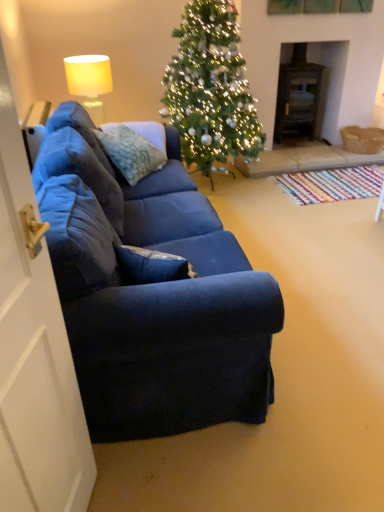
Question: From the image's perspective, does green matte christmas tree at center appear lower than matte yellow fabric lampshade at upper left?

Choices:
 (A) yes
 (B) no

Answer: (B)

Question: Considering the relative sizes of green matte christmas tree at center and matte yellow fabric lampshade at upper left in the image provided, is green matte christmas tree at center smaller than matte yellow fabric lampshade at upper left?

Choices:
 (A) no
 (B) yes

Answer: (A)

Question: Does green matte christmas tree at center turn towards matte yellow fabric lampshade at upper left?

Choices:
 (A) yes
 (B) no

Answer: (B)

Question: From the image's perspective, is green matte christmas tree at center on matte yellow fabric lampshade at upper left?

Choices:
 (A) no
 (B) yes

Answer: (B)

Question: Is green matte christmas tree at center not near matte yellow fabric lampshade at upper left?

Choices:
 (A) no
 (B) yes

Answer: (A)

Question: Relative to dark wood fireplace at center right, is textured blue pillow at center in front or behind?

Choices:
 (A) front
 (B) behind

Answer: (A)

Question: Considering the positions of point (125, 138) and point (278, 105), is point (125, 138) closer or farther from the camera than point (278, 105)?

Choices:
 (A) farther
 (B) closer

Answer: (B)

Question: Is textured blue pillow at center taller or shorter than dark wood fireplace at center right?

Choices:
 (A) tall
 (B) short

Answer: (B)

Question: Is textured blue pillow at center spatially inside dark wood fireplace at center right, or outside of it?

Choices:
 (A) outside
 (B) inside

Answer: (A)

Question: Is matte yellow fabric lampshade at upper left inside the boundaries of white matte door at left, or outside?

Choices:
 (A) outside
 (B) inside

Answer: (A)

Question: In the image, is matte yellow fabric lampshade at upper left on the left side or the right side of white matte door at left?

Choices:
 (A) left
 (B) right

Answer: (A)

Question: Is matte yellow fabric lampshade at upper left wider or thinner than white matte door at left?

Choices:
 (A) wide
 (B) thin

Answer: (A)

Question: Based on their sizes in the image, would you say matte yellow fabric lampshade at upper left is bigger or smaller than white matte door at left?

Choices:
 (A) small
 (B) big

Answer: (B)

Question: From a real-world perspective, is green matte christmas tree at center above or below white matte door at left?

Choices:
 (A) below
 (B) above

Answer: (B)

Question: In terms of size, does green matte christmas tree at center appear bigger or smaller than white matte door at left?

Choices:
 (A) big
 (B) small

Answer: (A)